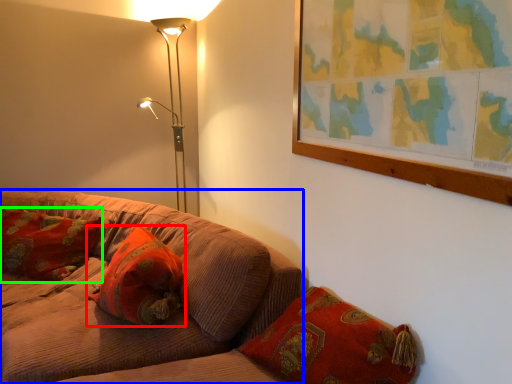
Question: Which object is the closest to the pillow (highlighted by a red box)? Choose among these: studio couch (highlighted by a blue box) or pillow (highlighted by a green box).

Choices:
 (A) studio couch
 (B) pillow

Answer: (A)